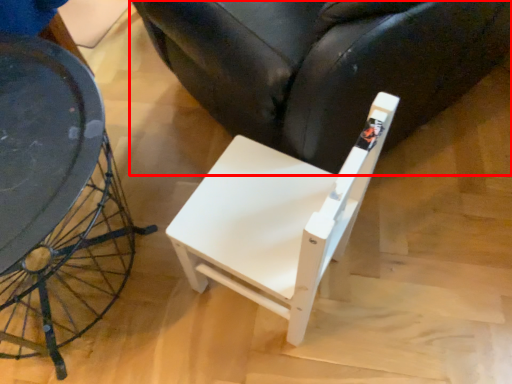
Question: From the image's perspective, what is the correct spatial positioning of chair (annotated by the red box) in reference to chair?

Choices:
 (A) below
 (B) above

Answer: (B)